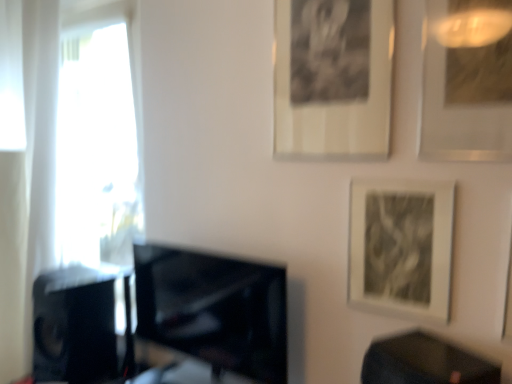
From the picture: What is the approximate height of black matte picture frame at upper center, positioned as the first picture frame in left-to-right order?

The height of black matte picture frame at upper center, positioned as the first picture frame in left-to-right order, is 20.84 inches.

What do you see at coordinates (74, 325) in the screenshot? I see `black matte speaker at left` at bounding box center [74, 325].

Measure the distance between metallic silver picture frame at upper right, which is the 1th picture frame in right-to-left order, and camera.

metallic silver picture frame at upper right, which is the 1th picture frame in right-to-left order, and camera are 1.09 meters apart.

What is the approximate width of matte black picture frame at lower right, which is the second picture frame from left to right?

1.06 inches.

The height and width of the screenshot is (384, 512). Identify the location of matte black picture frame at lower right, positioned as the second picture frame in right-to-left order. click(x=401, y=247).

Find the location of a particular element. The width and height of the screenshot is (512, 384). black matte picture frame at upper center, positioned as the first picture frame in left-to-right order is located at coordinates (332, 79).

Could you tell me if white sheer curtain at left is facing matte black picture frame at lower right, positioned as the second picture frame in right-to-left order?

No.

Which object is more forward, white sheer curtain at left or matte black picture frame at lower right, which is the second picture frame from left to right?

matte black picture frame at lower right, which is the second picture frame from left to right.

Is white sheer curtain at left outside of matte black picture frame at lower right, which is the second picture frame from left to right?

white sheer curtain at left is positioned outside matte black picture frame at lower right, which is the second picture frame from left to right.

Is white sheer curtain at left smaller than matte black picture frame at lower right, which is the second picture frame from left to right?

Incorrect, white sheer curtain at left is not smaller in size than matte black picture frame at lower right, which is the second picture frame from left to right.

Looking at this image, between black glossy tv at center and black matte speaker at left, which one is positioned behind?

black matte speaker at left is further from the camera.

Considering the sizes of objects black glossy tv at center and black matte speaker at left in the image provided, who is smaller, black glossy tv at center or black matte speaker at left?

With smaller size is black matte speaker at left.

From a real-world perspective, is black glossy tv at center on black matte speaker at left?

Yes, from a real-world perspective, black glossy tv at center is on top of black matte speaker at left.

Is black glossy tv at center next to black matte speaker at left?

No, black glossy tv at center is not making contact with black matte speaker at left.

Does black matte picture frame at upper center, acting as the 3th picture frame starting from the right, have a lesser height compared to matte black picture frame at lower right, positioned as the second picture frame in right-to-left order?

No, black matte picture frame at upper center, acting as the 3th picture frame starting from the right, is not shorter than matte black picture frame at lower right, positioned as the second picture frame in right-to-left order.

Visually, is black matte picture frame at upper center, positioned as the first picture frame in left-to-right order, positioned to the left or to the right of matte black picture frame at lower right, positioned as the second picture frame in right-to-left order?

black matte picture frame at upper center, positioned as the first picture frame in left-to-right order, is positioned on matte black picture frame at lower right, positioned as the second picture frame in right-to-left order,'s left side.

How different are the orientations of black matte picture frame at upper center, acting as the 3th picture frame starting from the right, and matte black picture frame at lower right, which is the second picture frame from left to right, in degrees?

0.000447 degrees.

Is matte black picture frame at lower right, positioned as the second picture frame in right-to-left order, positioned with its back to white sheer curtain at left?

No, matte black picture frame at lower right, positioned as the second picture frame in right-to-left order, is not facing the opposite direction of white sheer curtain at left.

Which object is positioned more to the left, matte black picture frame at lower right, positioned as the second picture frame in right-to-left order, or white sheer curtain at left?

Positioned to the left is white sheer curtain at left.

From the image's perspective, is matte black picture frame at lower right, which is the second picture frame from left to right, positioned above or below white sheer curtain at left?

matte black picture frame at lower right, which is the second picture frame from left to right, is below white sheer curtain at left.

Considering the relative sizes of matte black picture frame at lower right, which is the second picture frame from left to right, and white sheer curtain at left in the image provided, is matte black picture frame at lower right, which is the second picture frame from left to right, thinner than white sheer curtain at left?

Yes.

Which is farther from the camera, (362,216) or (413,330)?

The point (362,216) is behind.

Are matte black picture frame at lower right, which is the second picture frame from left to right, and black glossy table at lower right located far from each other?

No.

What's the angular difference between matte black picture frame at lower right, positioned as the second picture frame in right-to-left order, and black glossy table at lower right's facing directions?

26.6 degrees.

Is matte black picture frame at lower right, which is the second picture frame from left to right, at the right side of black glossy table at lower right?

Correct, you'll find matte black picture frame at lower right, which is the second picture frame from left to right, to the right of black glossy table at lower right.

Is black glossy table at lower right inside black glossy tv at center?

That's incorrect, black glossy table at lower right is not inside black glossy tv at center.

Where is `table below the black glossy tv at center (from the image's perspective)`? The width and height of the screenshot is (512, 384). table below the black glossy tv at center (from the image's perspective) is located at coordinates (424, 362).

From the image's perspective, between black glossy tv at center and black glossy table at lower right, who is located below?

black glossy table at lower right.

Considering the relative sizes of black glossy tv at center and black glossy table at lower right in the image provided, is black glossy tv at center shorter than black glossy table at lower right?

No, black glossy tv at center is not shorter than black glossy table at lower right.

Is matte black picture frame at lower right, positioned as the second picture frame in right-to-left order, placed right next to black glossy tv at center?

No, matte black picture frame at lower right, positioned as the second picture frame in right-to-left order, is not next to black glossy tv at center.

Considering the sizes of objects matte black picture frame at lower right, positioned as the second picture frame in right-to-left order, and black glossy tv at center in the image provided, who is wider, matte black picture frame at lower right, positioned as the second picture frame in right-to-left order, or black glossy tv at center?

With larger width is black glossy tv at center.

Considering the sizes of matte black picture frame at lower right, which is the second picture frame from left to right, and black glossy tv at center in the image, is matte black picture frame at lower right, which is the second picture frame from left to right, taller or shorter than black glossy tv at center?

In the image, matte black picture frame at lower right, which is the second picture frame from left to right, appears to be shorter than black glossy tv at center.

Considering the relative positions of matte black picture frame at lower right, which is the second picture frame from left to right, and black glossy tv at center in the image provided, is matte black picture frame at lower right, which is the second picture frame from left to right, in front of black glossy tv at center?

Yes, matte black picture frame at lower right, which is the second picture frame from left to right, is closer to the viewer.

You are a GUI agent. You are given a task and a screenshot of the screen. Output one action in this format:
    pyautogui.click(x=<x>, y=<y>)
    Task: Click on the window located above the matte black picture frame at lower right, positioned as the second picture frame in right-to-left order (from the image's perspective)
    The image size is (512, 384).
    Given the screenshot: What is the action you would take?
    pyautogui.click(x=99, y=135)

This screenshot has height=384, width=512. There is a black matte speaker at left. Find the location of `television above it (from a real-world perspective)`. television above it (from a real-world perspective) is located at coordinates (214, 309).

Which object lies nearer to the anchor point metallic silver picture frame at upper right, which is the 1th picture frame in right-to-left order, black glossy tv at center or black glossy table at lower right?

Among the two, black glossy table at lower right is located nearer to metallic silver picture frame at upper right, which is the 1th picture frame in right-to-left order.

Estimate the real-world distances between objects in this image. Which object is closer to black matte picture frame at upper center, acting as the 3th picture frame starting from the right, matte black picture frame at lower right, positioned as the second picture frame in right-to-left order, or white sheer curtain at left?

matte black picture frame at lower right, positioned as the second picture frame in right-to-left order, is positioned closer to the anchor black matte picture frame at upper center, acting as the 3th picture frame starting from the right.

Which object lies nearer to the anchor point black matte picture frame at upper center, positioned as the first picture frame in left-to-right order, matte black picture frame at lower right, positioned as the second picture frame in right-to-left order, or black glossy table at lower right?

matte black picture frame at lower right, positioned as the second picture frame in right-to-left order.

Looking at the image, which one is located further to black matte speaker at left, black glossy tv at center or black glossy table at lower right?

black glossy table at lower right lies further to black matte speaker at left than the other object.

From the image, which object appears to be farther from black matte speaker at left, white sheer curtain at left or matte black picture frame at lower right, positioned as the second picture frame in right-to-left order?

matte black picture frame at lower right, positioned as the second picture frame in right-to-left order.

From the image, which object appears to be nearer to metallic silver picture frame at upper right, positioned as the third picture frame in left-to-right order, white sheer curtain at left or black matte picture frame at upper center, positioned as the first picture frame in left-to-right order?

black matte picture frame at upper center, positioned as the first picture frame in left-to-right order, lies closer to metallic silver picture frame at upper right, positioned as the third picture frame in left-to-right order, than the other object.

Considering their positions, is black glossy tv at center positioned closer to black glossy table at lower right than matte black picture frame at lower right, positioned as the second picture frame in right-to-left order?

matte black picture frame at lower right, positioned as the second picture frame in right-to-left order, is positioned closer to the anchor black glossy table at lower right.

Estimate the real-world distances between objects in this image. Which object is closer to metallic silver picture frame at upper right, which is the 1th picture frame in right-to-left order, black glossy tv at center or white sheer curtain at left?

black glossy tv at center.

The height and width of the screenshot is (384, 512). Identify the location of picture frame between metallic silver picture frame at upper right, which is the 1th picture frame in right-to-left order, and black glossy table at lower right vertically. (401, 247).

Locate an element on the screen. Image resolution: width=512 pixels, height=384 pixels. television between black matte picture frame at upper center, acting as the 3th picture frame starting from the right, and black glossy table at lower right in the up-down direction is located at coordinates (214, 309).

At what (x,y) coordinates should I click in order to perform the action: click on television situated between black matte speaker at left and metallic silver picture frame at upper right, which is the 1th picture frame in right-to-left order, from left to right. Please return your answer as a coordinate pair (x, y). Looking at the image, I should click on (214, 309).

I want to click on television between black matte speaker at left and black glossy table at lower right from left to right, so click(x=214, y=309).